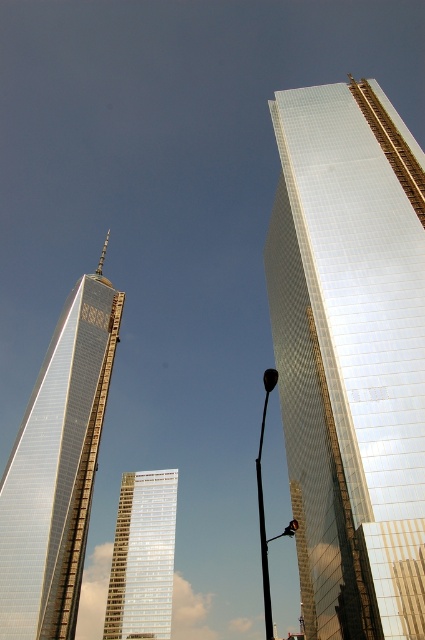
You are a city planner evaluating the skyline. You need to determine if the shiny glass skyscraper at left can be seen from the observation deck of the silver reflective glass building at center. Based on their sizes and positions, what do you conclude?

The shiny glass skyscraper at left is larger in size than the silver reflective glass building at center, so it can be seen from the observation deck of the silver reflective glass building at center because its height would allow it to be visible over the shorter building.

You are standing at the center of the image and want to locate the shiny glass skyscraper at right. According to the coordinates provided, in which direction should you look to find it?

The shiny glass skyscraper at right is located at coordinates point (x=351, y=355), which means you should look to the right side of the image to find it.